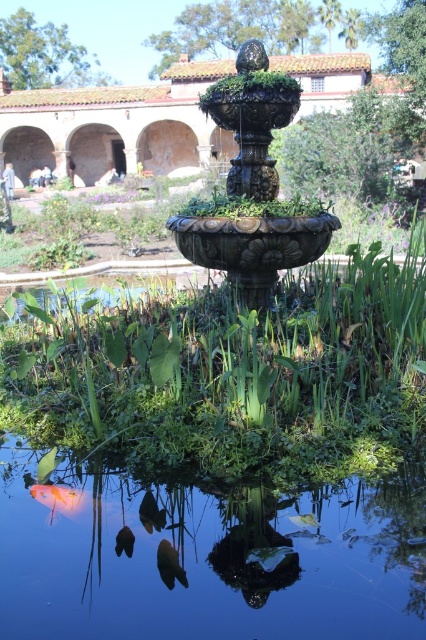
Question: Does bronze textured fountain at center have a lesser width compared to orange glossy fish at lower left?

Choices:
 (A) yes
 (B) no

Answer: (B)

Question: Which is nearer to the bronze textured fountain at center?

Choices:
 (A) glossy blue water at center bottom
 (B) orange glossy fish at lower left

Answer: (B)

Question: Which of the following is the closest to the observer?

Choices:
 (A) (261, 509)
 (B) (265, 275)

Answer: (A)

Question: Can you confirm if glossy blue water at center bottom is smaller than orange glossy fish at lower left?

Choices:
 (A) yes
 (B) no

Answer: (B)

Question: Where is glossy blue water at center bottom located in relation to orange glossy fish at lower left in the image?

Choices:
 (A) below
 (B) above

Answer: (A)

Question: Which of these objects is positioned farthest from the bronze textured fountain at center?

Choices:
 (A) orange glossy fish at lower left
 (B) glossy blue water at center bottom

Answer: (B)